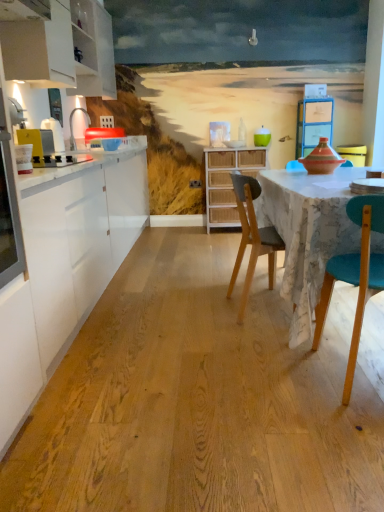
You are a GUI agent. You are given a task and a screenshot of the screen. Output one action in this format:
    pyautogui.click(x=<x>, y=<y>)
    Task: Click on the vacant space in front of wooden chair at center
    The height and width of the screenshot is (512, 384).
    Given the screenshot: What is the action you would take?
    pyautogui.click(x=253, y=346)